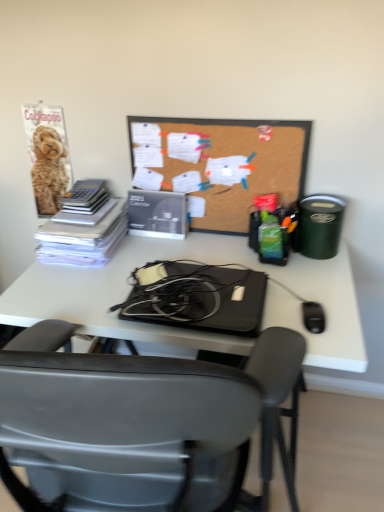
Question: Should I look upward or downward to see black plastic mouse at lower right?

Choices:
 (A) down
 (B) up

Answer: (A)

Question: Can we say corkboard at center lies outside black plastic chair at center?

Choices:
 (A) yes
 (B) no

Answer: (A)

Question: From a real-world perspective, is corkboard at center located higher than black plastic chair at center?

Choices:
 (A) yes
 (B) no

Answer: (A)

Question: Considering the relative sizes of corkboard at center and black plastic chair at center in the image provided, is corkboard at center thinner than black plastic chair at center?

Choices:
 (A) yes
 (B) no

Answer: (A)

Question: From the image's perspective, is corkboard at center on black plastic chair at center?

Choices:
 (A) yes
 (B) no

Answer: (A)

Question: Is corkboard at center facing away from black plastic chair at center?

Choices:
 (A) no
 (B) yes

Answer: (A)

Question: Is corkboard at center next to black plastic chair at center?

Choices:
 (A) no
 (B) yes

Answer: (A)

Question: Does black plastic chair at center come in front of black matte laptop at center?

Choices:
 (A) no
 (B) yes

Answer: (B)

Question: From the image's perspective, is black plastic chair at center on black matte laptop at center?

Choices:
 (A) yes
 (B) no

Answer: (B)

Question: Would you say black plastic chair at center is outside black matte laptop at center?

Choices:
 (A) no
 (B) yes

Answer: (B)

Question: Is black plastic chair at center oriented towards black matte laptop at center?

Choices:
 (A) no
 (B) yes

Answer: (A)

Question: Can you confirm if black plastic chair at center is bigger than black matte laptop at center?

Choices:
 (A) no
 (B) yes

Answer: (B)

Question: Does black plastic chair at center have a lesser height compared to black matte laptop at center?

Choices:
 (A) no
 (B) yes

Answer: (A)

Question: Is corkboard at center to the right of white paper stack at left from the viewer's perspective?

Choices:
 (A) yes
 (B) no

Answer: (A)